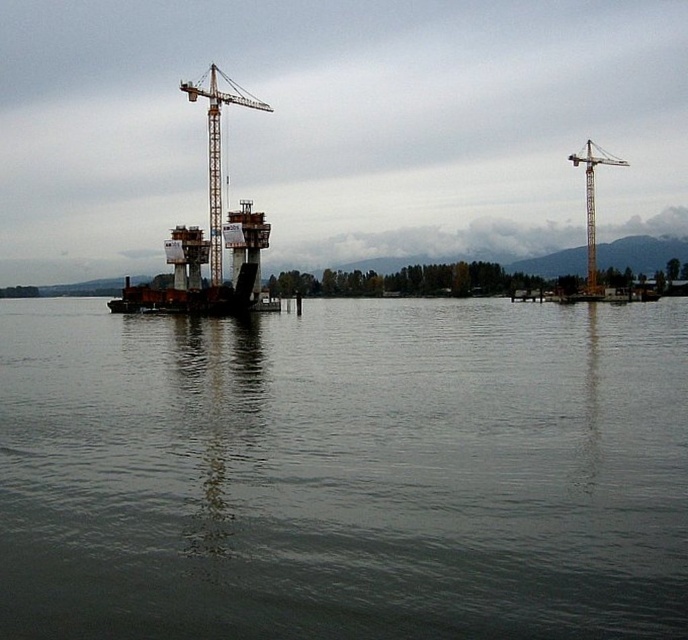
Is gray matte water at center thinner than yellow metallic crane at right?

No.

Which is behind, point (433, 545) or point (603, 157)?

Point (603, 157)

The height and width of the screenshot is (640, 688). I want to click on gray matte water at center, so click(344, 472).

Does orange metallic bridge at center have a smaller size compared to yellow metallic crane at right?

Yes, orange metallic bridge at center is smaller than yellow metallic crane at right.

Is orange metallic bridge at center positioned in front of yellow metallic crane at right?

Yes.

Who is more distant from viewer, (255, 264) or (591, 172)?

The point (591, 172) is more distant.

Identify the location of orange metallic bridge at center. The height and width of the screenshot is (640, 688). (200, 275).

Is orange metallic bridge at center thinner than yellow metallic crane at center?

No.

Can you confirm if orange metallic bridge at center is positioned below yellow metallic crane at center?

Yes.

Which is behind, point (193, 234) or point (206, 144)?

Positioned behind is point (193, 234).

Where is `orange metallic bridge at center`? The height and width of the screenshot is (640, 688). orange metallic bridge at center is located at coordinates (200, 275).